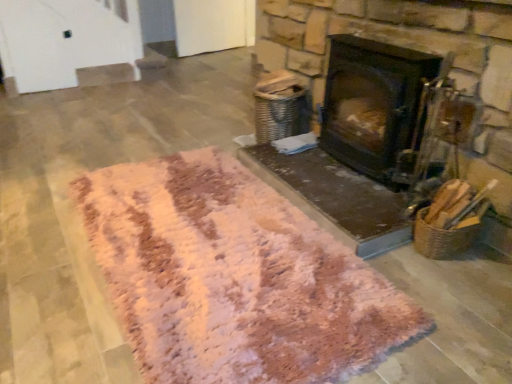
Question: Considering the positions of point (284, 236) and point (420, 119), is point (284, 236) closer or farther from the camera than point (420, 119)?

Choices:
 (A) closer
 (B) farther

Answer: (A)

Question: Which is correct: pink shaggy rug at center is inside black matte wood burning stove at center, or outside of it?

Choices:
 (A) inside
 (B) outside

Answer: (B)

Question: In the image, is pink shaggy rug at center positioned in front of or behind black matte wood burning stove at center?

Choices:
 (A) front
 (B) behind

Answer: (A)

Question: Looking at their shapes, would you say black matte wood burning stove at center is wider or thinner than pink shaggy rug at center?

Choices:
 (A) thin
 (B) wide

Answer: (A)

Question: Is point (358, 145) closer or farther from the camera than point (288, 211)?

Choices:
 (A) closer
 (B) farther

Answer: (B)

Question: From a real-world perspective, relative to pink shaggy rug at center, is black matte wood burning stove at center vertically above or below?

Choices:
 (A) below
 (B) above

Answer: (B)

Question: Relative to pink shaggy rug at center, is black matte wood burning stove at center in front or behind?

Choices:
 (A) behind
 (B) front

Answer: (A)